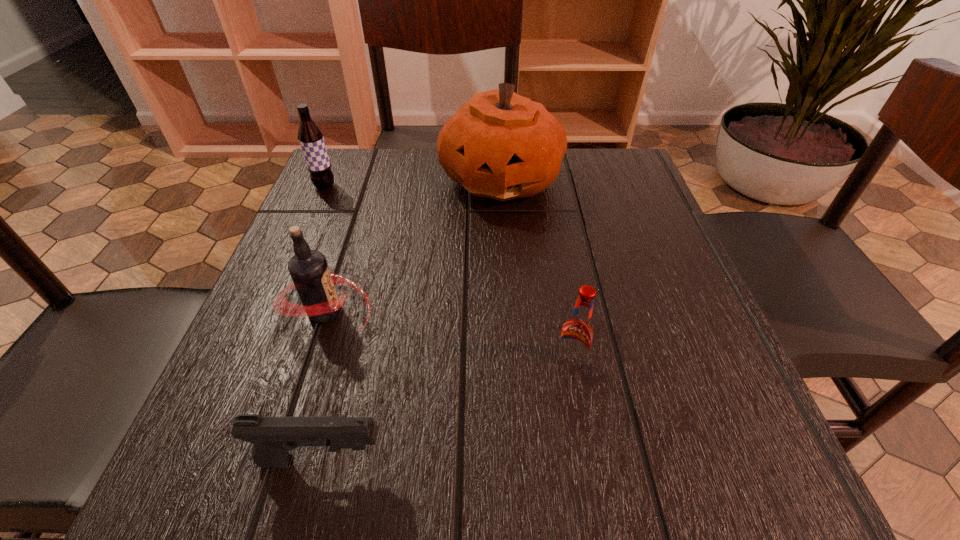
In the image, there is a desktop. At what (x,y) coordinates should I click in order to perform the action: click on vacant area at the left edge. Please return your answer as a coordinate pair (x, y). The height and width of the screenshot is (540, 960). Looking at the image, I should click on (327, 376).

In the image, there is a desktop. Where is `vacant space at the right edge`? vacant space at the right edge is located at coordinates (653, 374).

Locate an element on the screen. free space at the far left corner of the desktop is located at coordinates (347, 170).

In the image, there is a desktop. Where is `vacant space at the far right corner`? This screenshot has height=540, width=960. vacant space at the far right corner is located at coordinates (632, 168).

The image size is (960, 540). In order to click on unoccupied position between the pumpkin and the farthest root beer in this screenshot , I will do `click(413, 183)`.

Image resolution: width=960 pixels, height=540 pixels. What are the coordinates of `blank region between the nearest root beer and the tallest object` in the screenshot? It's located at (536, 271).

Find the location of a particular element. unoccupied position between the pistol and the nearest root beer is located at coordinates (446, 412).

At what (x,y) coordinates should I click in order to perform the action: click on vacant space that's between the farthest root beer and the second nearest root beer. Please return your answer as a coordinate pair (x, y). Image resolution: width=960 pixels, height=540 pixels. Looking at the image, I should click on (325, 248).

Where is `free spot between the pumpkin and the shortest object`? This screenshot has width=960, height=540. free spot between the pumpkin and the shortest object is located at coordinates (412, 320).

Identify the location of free space between the nearest root beer and the farthest root beer. Image resolution: width=960 pixels, height=540 pixels. (447, 275).